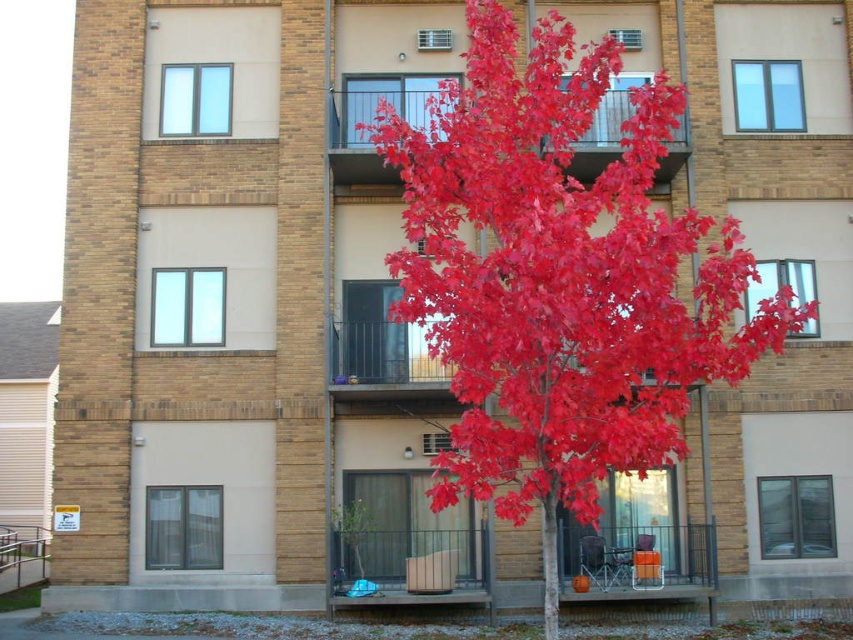
You are standing in front of the residential building and want to place a decorative pot exactly at the coordinates given for the bright red leaves at center. What are the coordinates where you should place the pot?

The coordinates for the bright red leaves at center are at point (560,280), so you should place the decorative pot at those coordinates.

You are standing in front of the building and notice the bright red leaves at center and the glass railing at upper center. Which object is closer to the ground?

The bright red leaves at center are closer to the ground because they are shorter than the glass railing at upper center.

You are standing in front of the residential building and notice the bright red leaves at center and the glass railing at upper center. Which object is closer to you?

The bright red leaves at center are closer to you because they are in front of the glass railing at upper center.